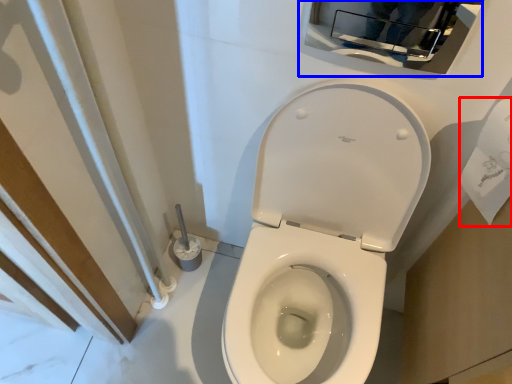
Question: Which object appears farthest to the camera in this image, toilet paper (highlighted by a red box) or medicine cabinet (highlighted by a blue box)?

Choices:
 (A) toilet paper
 (B) medicine cabinet

Answer: (B)